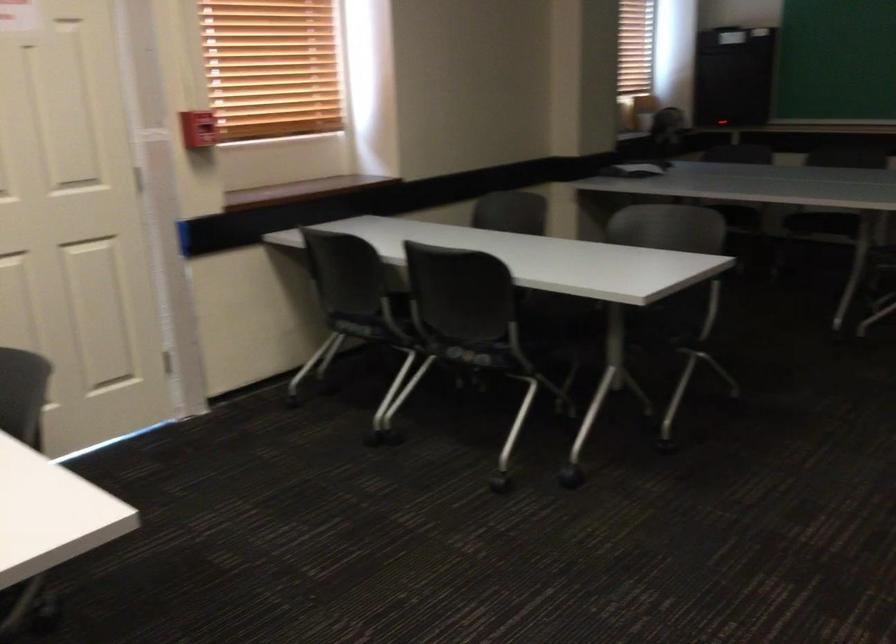
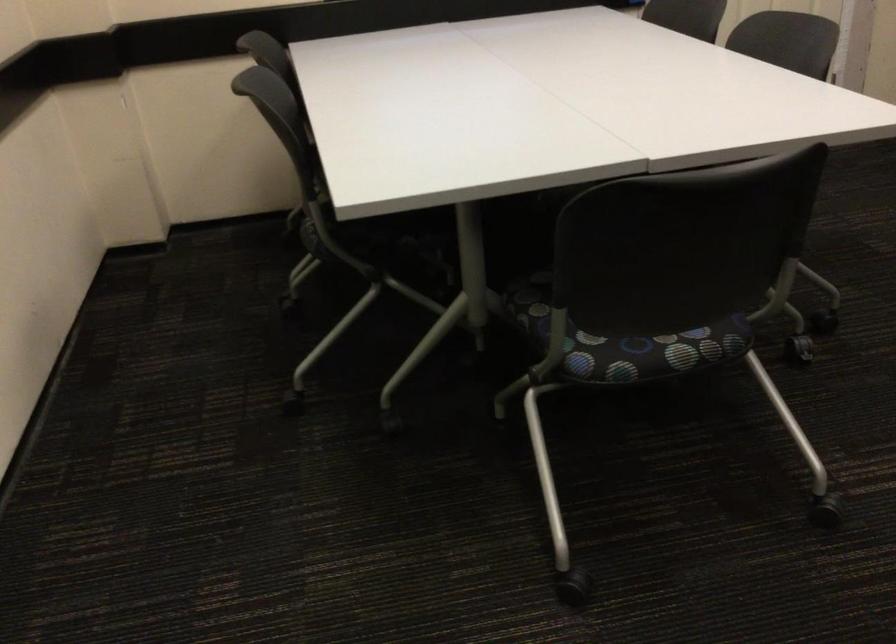
How did the camera likely rotate?

The camera's rotation is toward left-down.